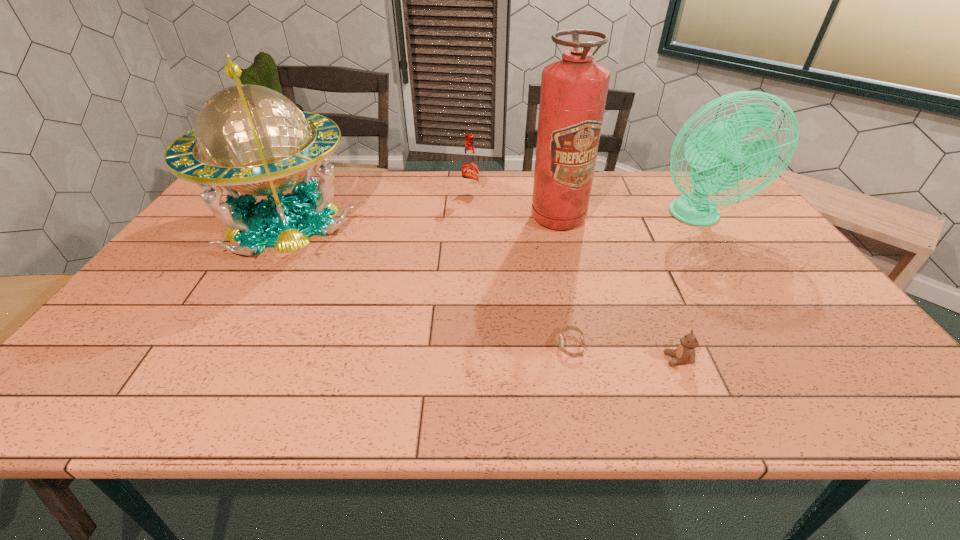
Identify the location of empty space between the fifth object from right to left and the fire extinguisher. (514, 206).

Where is `free space between the rightmost object and the shortest object`? free space between the rightmost object and the shortest object is located at coordinates (634, 281).

This screenshot has width=960, height=540. Find the location of `vacant area that lies between the fifth tallest object and the leftmost object`. vacant area that lies between the fifth tallest object and the leftmost object is located at coordinates (481, 291).

What are the coordinates of `vacant space that's between the fire extinguisher and the root beer` in the screenshot? It's located at (514, 206).

This screenshot has width=960, height=540. I want to click on empty space that is in between the globe and the third shortest object, so click(377, 208).

This screenshot has height=540, width=960. I want to click on free space between the globe and the fire extinguisher, so click(x=420, y=220).

Find the location of a particular element. This screenshot has width=960, height=540. empty location between the shortest object and the root beer is located at coordinates (520, 270).

Where is `free space between the fire extinguisher and the fan`? Image resolution: width=960 pixels, height=540 pixels. free space between the fire extinguisher and the fan is located at coordinates (627, 218).

At what (x,y) coordinates should I click in order to perform the action: click on vacant space that is in between the fire extinguisher and the fifth object from right to left. Please return your answer as a coordinate pair (x, y). This screenshot has width=960, height=540. Looking at the image, I should click on (514, 206).

Locate an element on the screen. The width and height of the screenshot is (960, 540). the fifth closest object to the fire extinguisher is located at coordinates (251, 139).